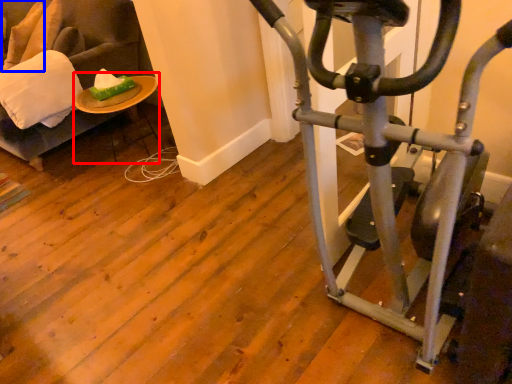
Question: Which of the following is the closest to the observer, table (highlighted by a red box) or pillow (highlighted by a blue box)?

Choices:
 (A) table
 (B) pillow

Answer: (A)